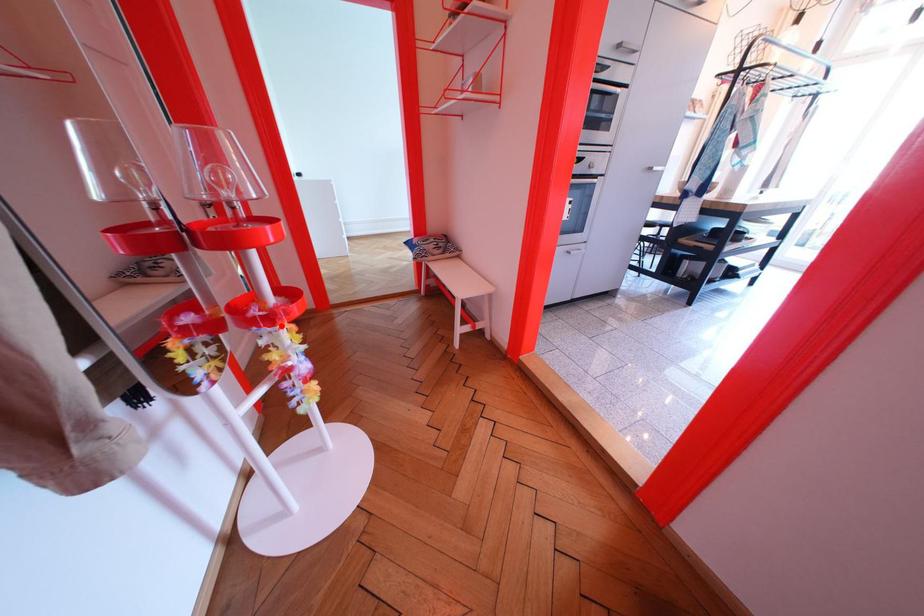
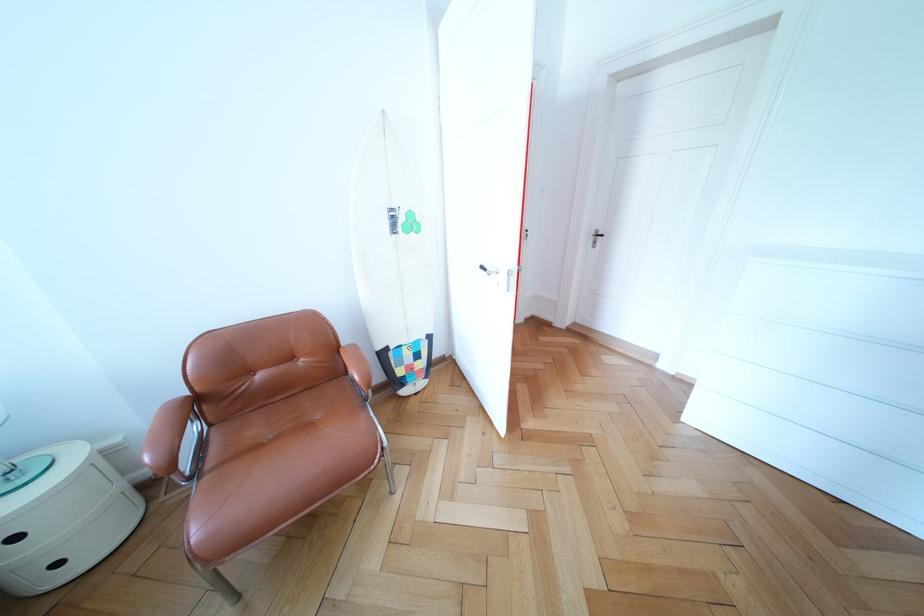
Question: I am providing you with two images of the same scene from different viewpoints. A red point is marked on the first image. At the location where the point appears in image 1, is it still visible in image 2?

Choices:
 (A) Yes
 (B) No

Answer: (B)